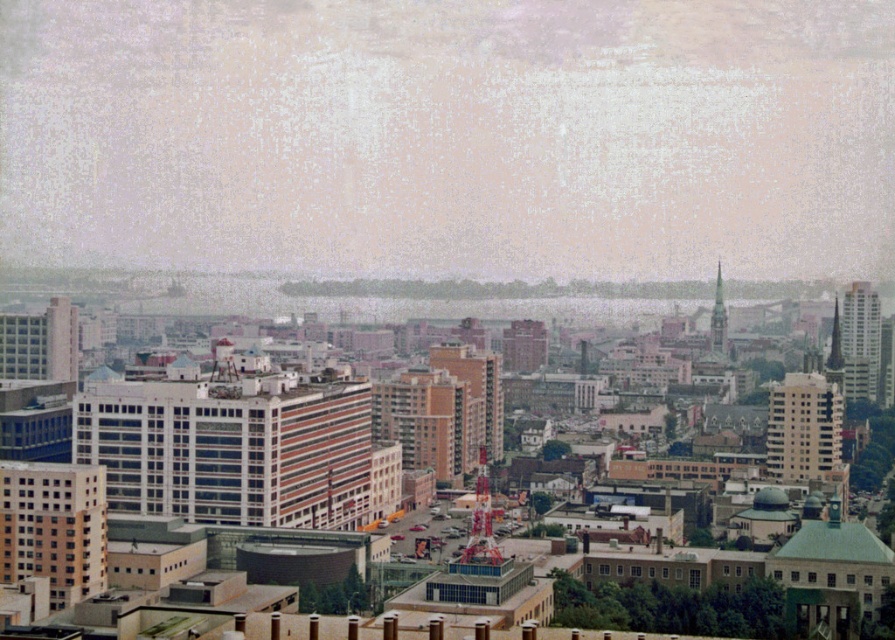
Does smooth glass skyscraper at right have a greater height compared to orange brick building at center?

Yes.

Does smooth glass skyscraper at right have a lesser height compared to orange brick building at center?

Incorrect, smooth glass skyscraper at right's height does not fall short of orange brick building at center's.

I want to click on smooth glass skyscraper at right, so click(x=859, y=340).

The image size is (895, 640). Find the location of `smooth glass skyscraper at right`. smooth glass skyscraper at right is located at coordinates (859, 340).

Is the position of white glass building at center less distant than that of brown brick building at center?

No, it is not.

Which is below, white glass building at center or brown brick building at center?

white glass building at center

Image resolution: width=895 pixels, height=640 pixels. I want to click on white glass building at center, so click(229, 449).

Does orange brick building at lower left appear under orange brick building at center?

Yes, orange brick building at lower left is below orange brick building at center.

Identify the location of orange brick building at lower left. The image size is (895, 640). (53, 528).

Is point (50, 486) farther from viewer compared to point (497, 412)?

Yes, point (50, 486) is farther from viewer.

The image size is (895, 640). In order to click on orange brick building at lower left in this screenshot , I will do `click(53, 528)`.